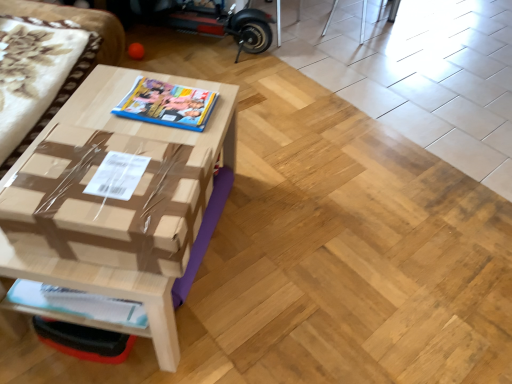
Question: Considering the relative sizes of brown cardboard table at center and brown cardboard couch at left in the image provided, is brown cardboard table at center wider than brown cardboard couch at left?

Choices:
 (A) no
 (B) yes

Answer: (A)

Question: From a real-world perspective, does brown cardboard table at center sit lower than brown cardboard couch at left?

Choices:
 (A) no
 (B) yes

Answer: (B)

Question: From the image's perspective, is brown cardboard table at center beneath brown cardboard couch at left?

Choices:
 (A) no
 (B) yes

Answer: (B)

Question: Considering the relative sizes of brown cardboard table at center and brown cardboard couch at left in the image provided, is brown cardboard table at center bigger than brown cardboard couch at left?

Choices:
 (A) yes
 (B) no

Answer: (B)

Question: Can you confirm if brown cardboard table at center is thinner than brown cardboard couch at left?

Choices:
 (A) yes
 (B) no

Answer: (A)

Question: From the image's perspective, is brown cardboard table at center on top of brown cardboard couch at left?

Choices:
 (A) yes
 (B) no

Answer: (B)

Question: Can you confirm if matte plastic magazine at center, which is the second magazine from bottom to top, is thinner than brown cardboard couch at left?

Choices:
 (A) yes
 (B) no

Answer: (A)

Question: Is matte plastic magazine at center, which is counted as the first magazine, starting from the back, outside brown cardboard couch at left?

Choices:
 (A) no
 (B) yes

Answer: (B)

Question: Does matte plastic magazine at center, placed as the 2th magazine when sorted from front to back, appear on the right side of brown cardboard couch at left?

Choices:
 (A) yes
 (B) no

Answer: (A)

Question: Could brown cardboard couch at left be considered to be inside matte plastic magazine at center, arranged as the 1th magazine when viewed from the top?

Choices:
 (A) no
 (B) yes

Answer: (A)

Question: Is matte plastic magazine at center, placed as the 2th magazine when sorted from front to back, in contact with brown cardboard couch at left?

Choices:
 (A) no
 (B) yes

Answer: (A)

Question: Is matte plastic magazine at center, which is counted as the first magazine, starting from the back, positioned with its back to brown cardboard couch at left?

Choices:
 (A) no
 (B) yes

Answer: (B)

Question: Is white glossy magazine at lower left, acting as the second magazine starting from the top, smaller than brown cardboard couch at left?

Choices:
 (A) yes
 (B) no

Answer: (A)